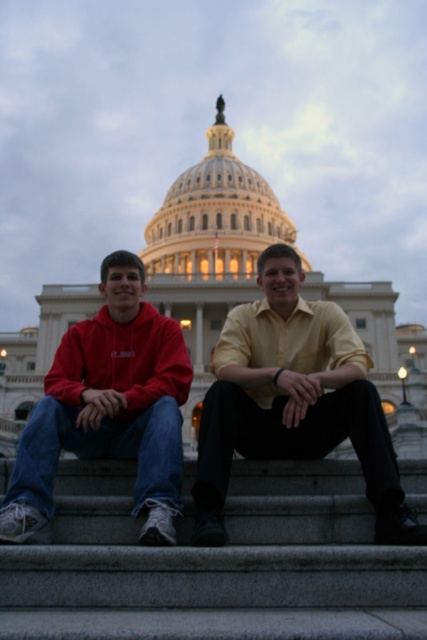
Question: Can you confirm if yellow satin shirt at center is positioned above matte red hoodie at center?

Choices:
 (A) yes
 (B) no

Answer: (B)

Question: Can you confirm if yellow satin shirt at center is smaller than matte red hoodie at center?

Choices:
 (A) no
 (B) yes

Answer: (A)

Question: Which point is farther to the camera?

Choices:
 (A) (40, 442)
 (B) (286, 294)

Answer: (B)

Question: Is yellow satin shirt at center behind matte red hoodie at center?

Choices:
 (A) yes
 (B) no

Answer: (B)

Question: Among these objects, which one is nearest to the camera?

Choices:
 (A) matte red hoodie at center
 (B) yellow satin shirt at center

Answer: (B)

Question: Which object appears farthest from the camera in this image?

Choices:
 (A) yellow satin shirt at center
 (B) matte red hoodie at center

Answer: (B)